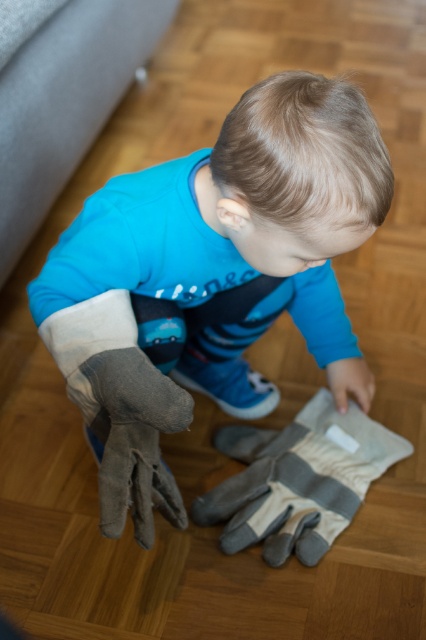
Question: Does gray fabric glove at center come behind gray fabric glove at lower left?

Choices:
 (A) no
 (B) yes

Answer: (B)

Question: Is gray fabric glove at center behind gray fabric glove at lower left?

Choices:
 (A) no
 (B) yes

Answer: (B)

Question: Which of the following is the closest to the observer?

Choices:
 (A) gray fabric glove at lower left
 (B) matte gray gloves at center
 (C) gray fabric glove at center

Answer: (B)

Question: Can you confirm if matte gray gloves at center is positioned above gray fabric glove at lower left?

Choices:
 (A) no
 (B) yes

Answer: (B)

Question: Which point is farther to the camera?

Choices:
 (A) (141, 516)
 (B) (334, 212)
 (C) (365, 438)

Answer: (C)

Question: Which point is farther to the camera?

Choices:
 (A) gray fabric glove at center
 (B) matte gray gloves at center
 (C) gray fabric glove at lower left

Answer: (A)